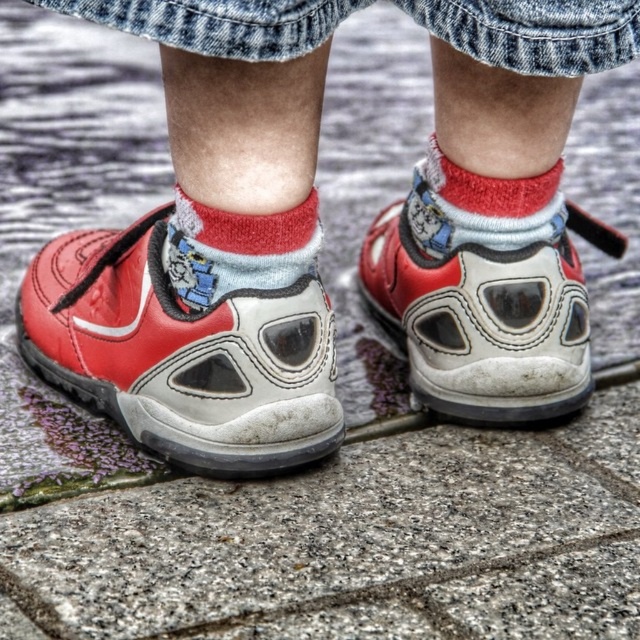
You are standing in a room and see two shoes, a matte leather shoe at center and a white leather shoe at center. Which one is nearer to you?

The matte leather shoe at center is closer to the viewer than the white leather shoe at center.

Looking at this image, you are a tailor measuring the distance between two items on a child. The items are the matte leather shoe at center and the red cotton sock at center. The tailor needs to ensure they are at least 15 inches apart for proper fitting. Is the current distance sufficient?

The distance between the matte leather shoe at center and the red cotton sock at center is 14.64 inches, which is less than the required 15 inches. Therefore, the current distance is not sufficient for proper fitting.